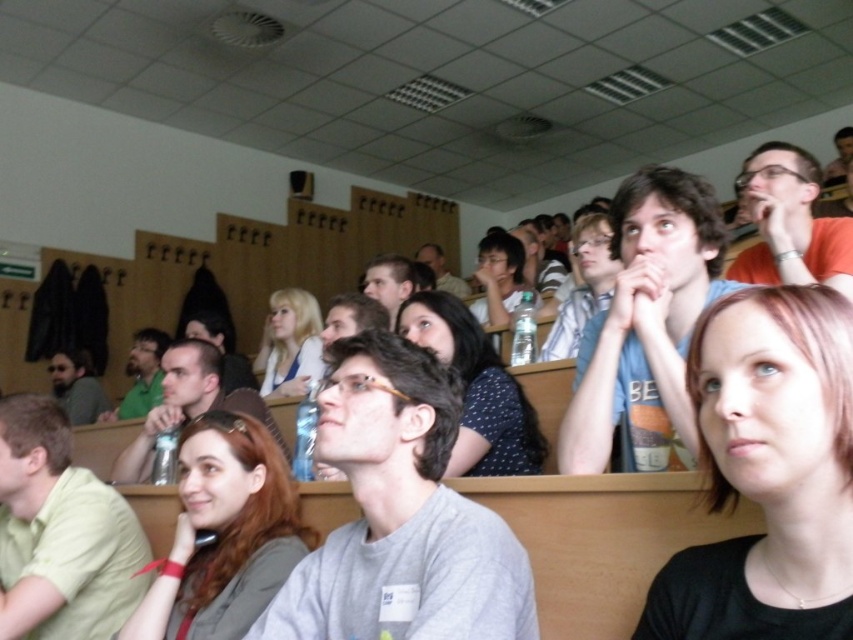
You are sitting in the front row of the lecture hall and notice two people wearing shirts of different colors in the center. Which shirt, the black matte shirt at center or the matte blue shirt at center, appears narrower?

The black matte shirt at center appears narrower compared to the matte blue shirt at center.

You are a person sitting in the front row of the lecture hall and you want to pass a note to someone. You see the black matte shirt at center and the matte blue shirt at center. Can you reach them without leaving your seat if your arms can extend 20 inches?

The distance between the black matte shirt at center and matte blue shirt at center is 20.16 inches. Since your arms can only extend 20 inches, you cannot reach them without leaving your seat.

You are sitting at the back of the lecture hall and want to ask a question to the person wearing the black matte shirt at center and the individual with blonde hair at center. Which one is closer to the front of the room?

The black matte shirt at center is located below blonde hair at center, meaning the blonde hair at center is closer to the front of the room.